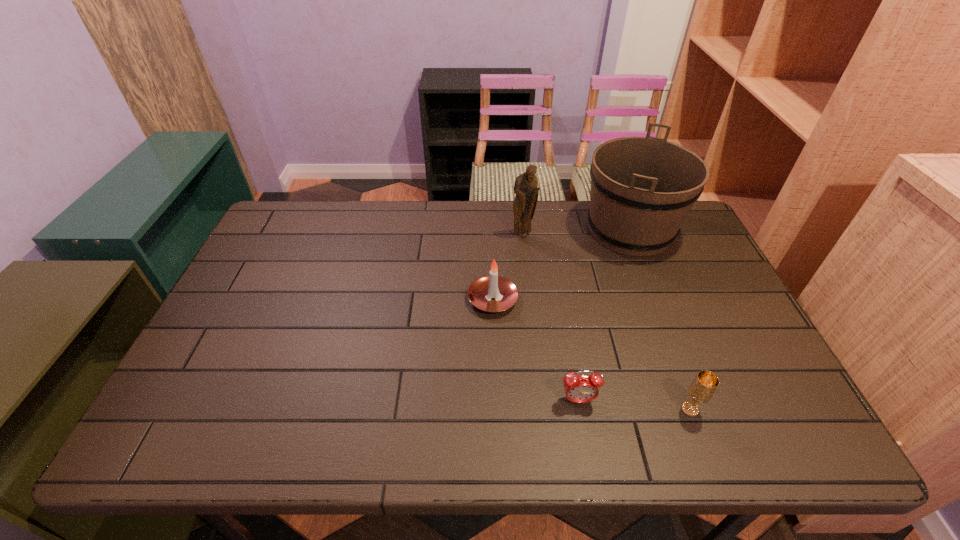
Identify the location of vacant region at the far left corner. The image size is (960, 540). (314, 220).

Identify the location of vacant space at the near right corner of the desktop. The height and width of the screenshot is (540, 960). (753, 446).

Find the location of a particular element. Image resolution: width=960 pixels, height=540 pixels. vacant region between the figurine and the third farthest object is located at coordinates (508, 267).

Find the location of `free space that is in between the bucket and the third object from left to right`. free space that is in between the bucket and the third object from left to right is located at coordinates (604, 315).

At what (x,y) coordinates should I click in order to perform the action: click on unoccupied position between the bucket and the chalice. Please return your answer as a coordinate pair (x, y). The image size is (960, 540). Looking at the image, I should click on (660, 320).

Locate an element on the screen. free spot between the candle and the third object from right to left is located at coordinates (536, 350).

Where is `free space between the figurine and the third object from left to right`? The height and width of the screenshot is (540, 960). free space between the figurine and the third object from left to right is located at coordinates (550, 318).

The image size is (960, 540). What are the coordinates of `vacant area that lies between the third tallest object and the third object from right to left` in the screenshot? It's located at (536, 350).

At what (x,y) coordinates should I click in order to perform the action: click on vacant area that lies between the figurine and the chalice. Please return your answer as a coordinate pair (x, y). This screenshot has height=540, width=960. Looking at the image, I should click on (607, 322).

Find the location of `free space between the third shortest object and the figurine`. free space between the third shortest object and the figurine is located at coordinates (508, 267).